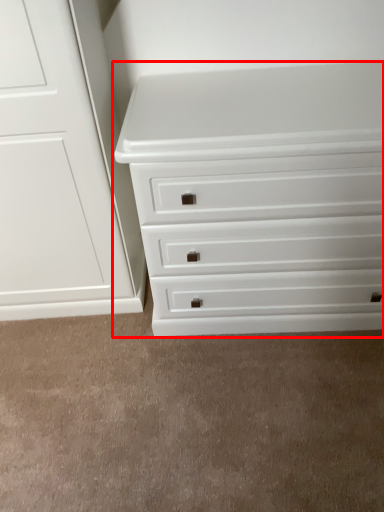
Question: From the image's perspective, what is the correct spatial relationship of chest of drawers (annotated by the red box) in relation to plain?

Choices:
 (A) below
 (B) above

Answer: (B)